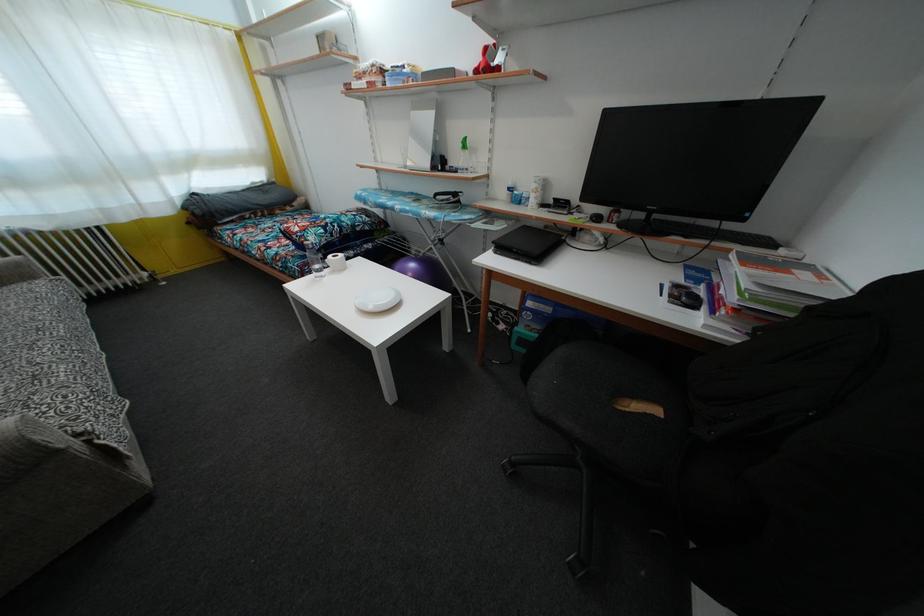
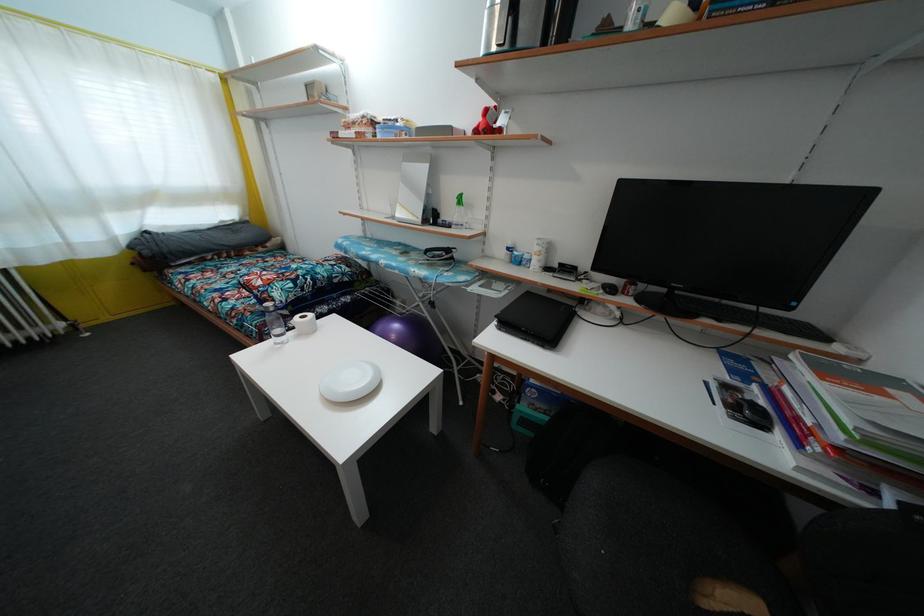
Question: Based on the continuous images, in which direction is the camera rotating? Reply with the corresponding letter.

Choices:
 (A) Left
 (B) Right
 (C) Up
 (D) Down

Answer: (C)